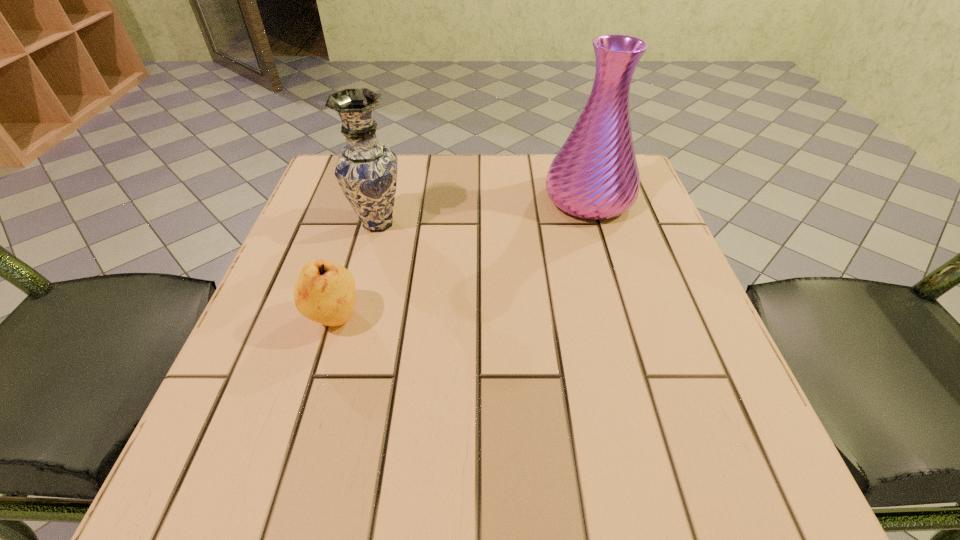
Where is `pear located at the left edge`? This screenshot has width=960, height=540. pear located at the left edge is located at coordinates [x=325, y=292].

Locate an element on the screen. This screenshot has height=540, width=960. object that is at the right edge is located at coordinates (595, 175).

Locate an element on the screen. Image resolution: width=960 pixels, height=540 pixels. object located in the far left corner section of the desktop is located at coordinates (366, 170).

You are a GUI agent. You are given a task and a screenshot of the screen. Output one action in this format:
    pyautogui.click(x=<x>, y=<y>)
    Task: Click on the object that is positioned at the far right corner
    The width and height of the screenshot is (960, 540).
    Given the screenshot: What is the action you would take?
    pyautogui.click(x=595, y=175)

Where is `vacant space at the far edge`? Image resolution: width=960 pixels, height=540 pixels. vacant space at the far edge is located at coordinates [546, 154].

Find the location of a particular element. The height and width of the screenshot is (540, 960). vacant space at the near edge of the desktop is located at coordinates (497, 454).

In the image, there is a desktop. At what (x,y) coordinates should I click in order to perform the action: click on free region at the right edge. Please return your answer as a coordinate pair (x, y). Looking at the image, I should click on (639, 274).

In the image, there is a desktop. Where is `vacant space at the far left corner`? This screenshot has width=960, height=540. vacant space at the far left corner is located at coordinates (332, 153).

I want to click on vacant area at the near left corner, so click(301, 455).

At what (x,y) coordinates should I click in order to perform the action: click on blank space at the far right corner. Please return your answer as a coordinate pair (x, y). The image size is (960, 540). Looking at the image, I should click on (644, 198).